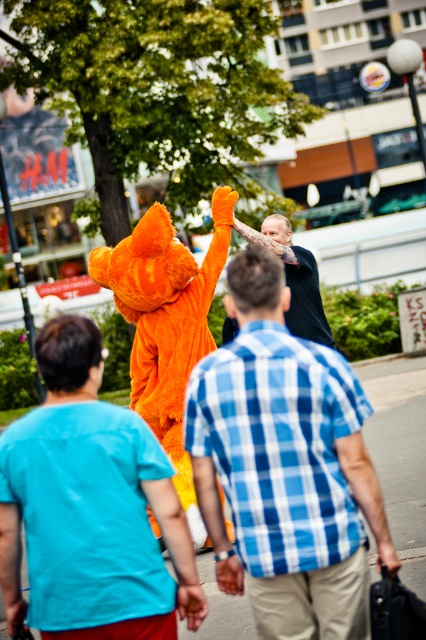
Who is lower down, orange plush costume at center or fuzzy orange costume at center?

orange plush costume at center

Who is taller, orange plush costume at center or fuzzy orange costume at center?

fuzzy orange costume at center is taller.

Is point (117, 609) positioned after point (175, 426)?

No, it is in front of (175, 426).

This screenshot has height=640, width=426. I want to click on orange plush costume at center, so click(89, 508).

Is fuzzy orange costume at center below black textured shirt at center?

Yes.

Does point (121, 253) lie behind point (319, 307)?

No.

Between point (155, 387) and point (305, 317), which one is positioned behind?

Point (305, 317)

This screenshot has height=640, width=426. Find the location of `fuzzy orange costume at center`. fuzzy orange costume at center is located at coordinates (166, 323).

Who is shorter, orange plush costume at center or black textured shirt at center?

black textured shirt at center

Locate an element on the screen. orange plush costume at center is located at coordinates (89, 508).

I want to click on orange plush costume at center, so click(89, 508).